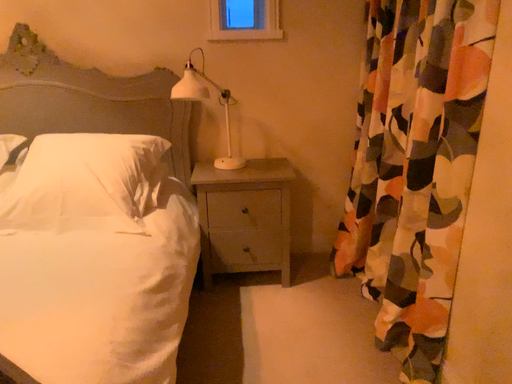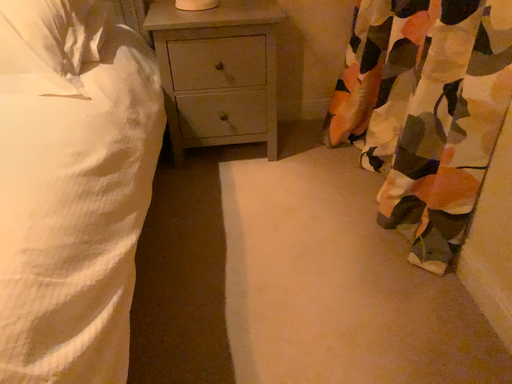
Question: Which way did the camera rotate in the video?

Choices:
 (A) rotated upward
 (B) rotated downward

Answer: (B)